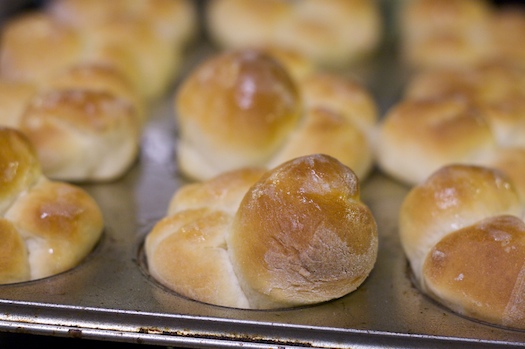
Find the location of `burnt black marks on baking tray`. burnt black marks on baking tray is located at coordinates coord(236,338), coord(75,330).